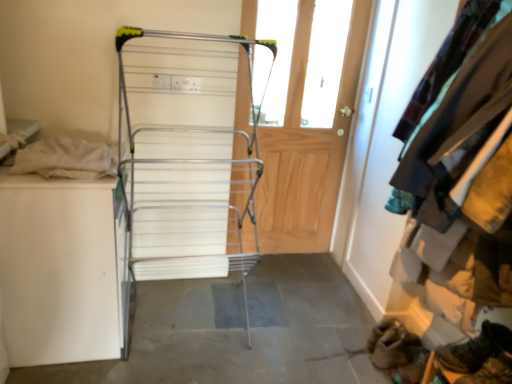
The width and height of the screenshot is (512, 384). What are the coordinates of `free point above gray concrete floor at center (from a real-world perspective)` in the screenshot? It's located at (234, 329).